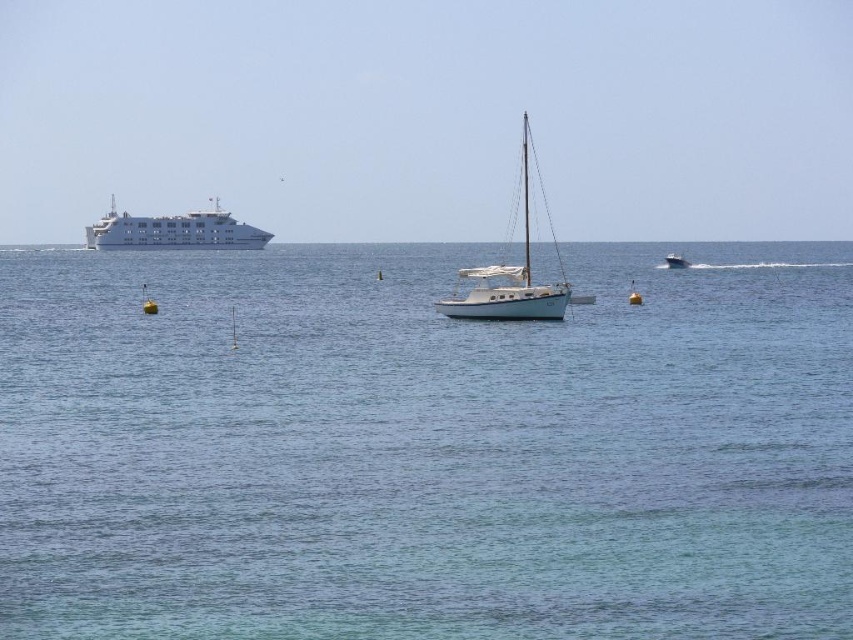
Question: Which object is closer to the camera taking this photo?

Choices:
 (A) metallic blue boat at center
 (B) white matte sailboat at center

Answer: (B)

Question: Based on their relative distances, which object is nearer to the metallic blue boat at center?

Choices:
 (A) white matte sailboat at center
 (B) white glossy cruise ship at left
 (C) clear blue water at center

Answer: (C)

Question: Which point is farther from the camera taking this photo?

Choices:
 (A) (397, 307)
 (B) (517, 276)
 (C) (90, 227)
 (D) (674, 257)

Answer: (C)

Question: Does white glossy cruise ship at left have a smaller size compared to metallic blue boat at center?

Choices:
 (A) yes
 (B) no

Answer: (B)

Question: Does white glossy cruise ship at left have a larger size compared to metallic blue boat at center?

Choices:
 (A) no
 (B) yes

Answer: (B)

Question: Does clear blue water at center have a lesser width compared to white matte sailboat at center?

Choices:
 (A) yes
 (B) no

Answer: (B)